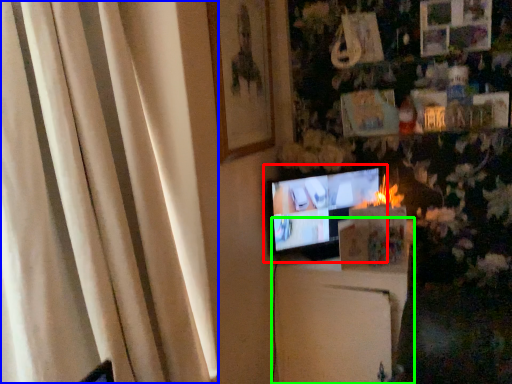
Question: Based on their relative distances, which object is farther from television (highlighted by a red box)? Choose from curtain (highlighted by a blue box) and furniture (highlighted by a green box).

Choices:
 (A) curtain
 (B) furniture

Answer: (A)